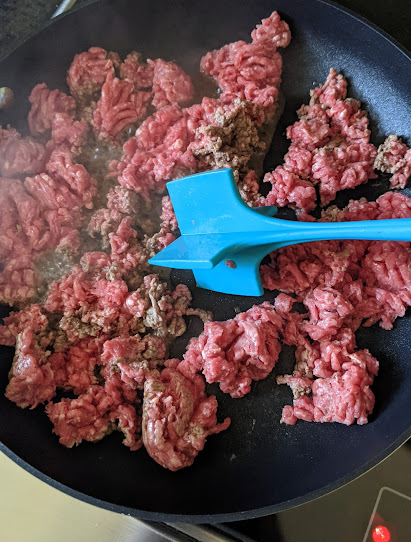
At what (x,y) coordinates should I click in order to perform the action: click on stove. Please return your answer as a coordinate pair (x, y). The image size is (411, 542). Looking at the image, I should click on (16, 489), (122, 531), (41, 530), (331, 516), (397, 469).